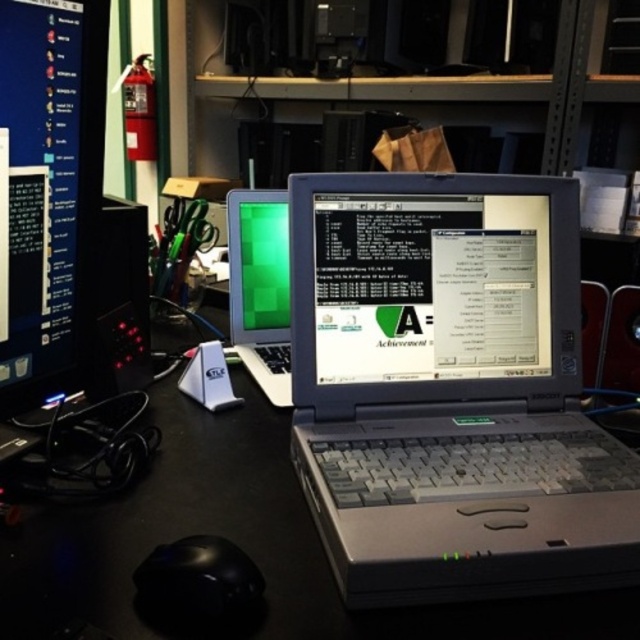
Question: Which point is farther to the camera?

Choices:
 (A) silver metallic laptop at center
 (B) black glossy mouse at lower left

Answer: (A)

Question: Does matte black monitor at left appear on the left side of black glossy mouse at lower left?

Choices:
 (A) yes
 (B) no

Answer: (A)

Question: Considering the relative positions of shiny silver laptop at center and green matte screen at center in the image provided, where is shiny silver laptop at center located with respect to green matte screen at center?

Choices:
 (A) right
 (B) left

Answer: (A)

Question: Which point is farther to the camera?

Choices:
 (A) (67, 515)
 (B) (534, 243)
 (C) (230, 256)

Answer: (C)

Question: Which of the following is the closest to the observer?

Choices:
 (A) silver metallic laptop at center
 (B) matte black monitor at left
 (C) green matte screen at center
 (D) black plastic table at center

Answer: (D)

Question: Does silver metallic laptop at center have a greater width compared to matte black monitor at left?

Choices:
 (A) yes
 (B) no

Answer: (A)